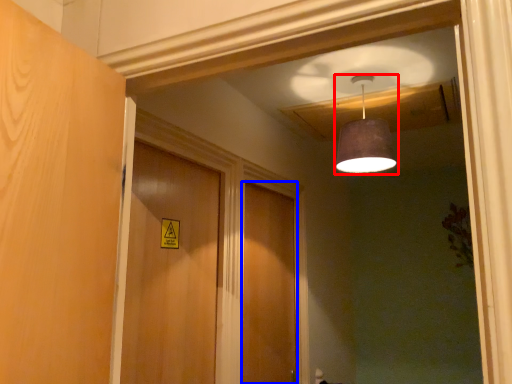
Question: Which point is closer to the camera, lamp (highlighted by a red box) or door (highlighted by a blue box)?

Choices:
 (A) lamp
 (B) door

Answer: (A)